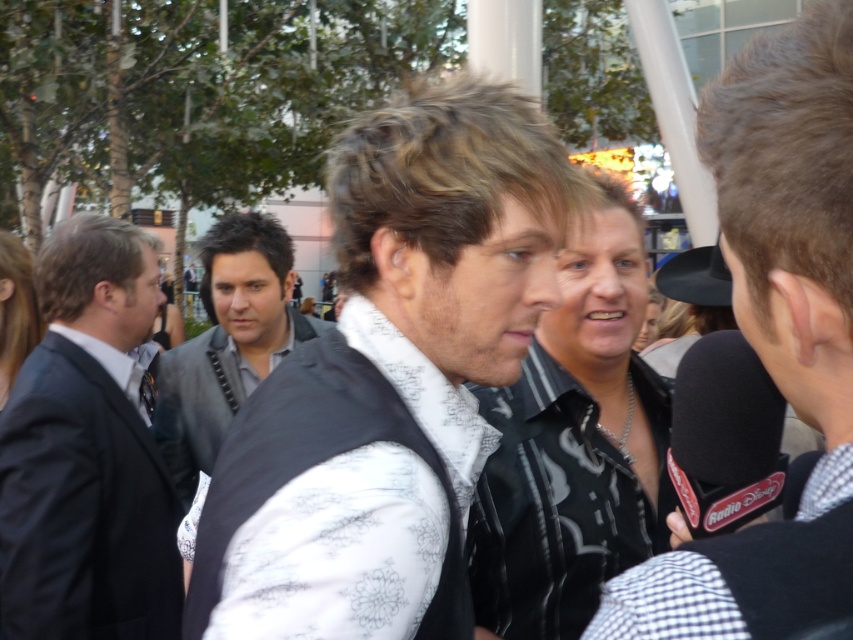
Does black leather jacket at center appear over dark gray textured vest at center?

Indeed, black leather jacket at center is positioned over dark gray textured vest at center.

Image resolution: width=853 pixels, height=640 pixels. What do you see at coordinates (775, 337) in the screenshot?
I see `black leather jacket at center` at bounding box center [775, 337].

Does point (672, 602) lie in front of point (229, 344)?

Yes, point (672, 602) is in front of point (229, 344).

What are the coordinates of `black leather jacket at center` in the screenshot? It's located at (775, 337).

Is white textured vest at center smaller than dark gray textured vest at center?

Yes, white textured vest at center is smaller than dark gray textured vest at center.

Looking at this image, does white textured vest at center have a lesser height compared to dark gray textured vest at center?

Yes, white textured vest at center is shorter than dark gray textured vest at center.

Is point (405, 291) in front of point (264, 240)?

Yes.

Where is `white textured vest at center`? This screenshot has width=853, height=640. white textured vest at center is located at coordinates (389, 378).

From the picture: Is white textured vest at center above dark gray suit at left?

Yes, white textured vest at center is above dark gray suit at left.

Is white textured vest at center positioned in front of dark gray suit at left?

That is True.

Which is in front, point (497, 116) or point (51, 440)?

Point (497, 116) is more forward.

This screenshot has width=853, height=640. Find the location of `white textured vest at center`. white textured vest at center is located at coordinates (389, 378).